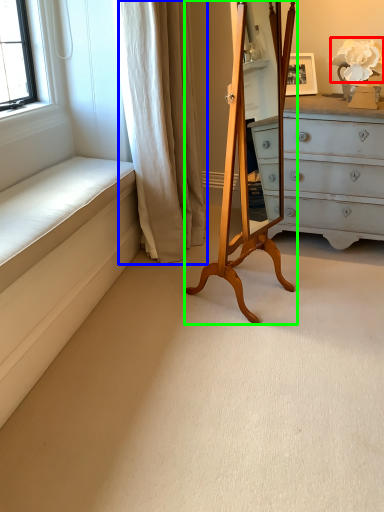
Question: Which object is the farthest from flower (highlighted by a red box)? Choose among these: curtain (highlighted by a blue box) or easel (highlighted by a green box).

Choices:
 (A) curtain
 (B) easel

Answer: (A)